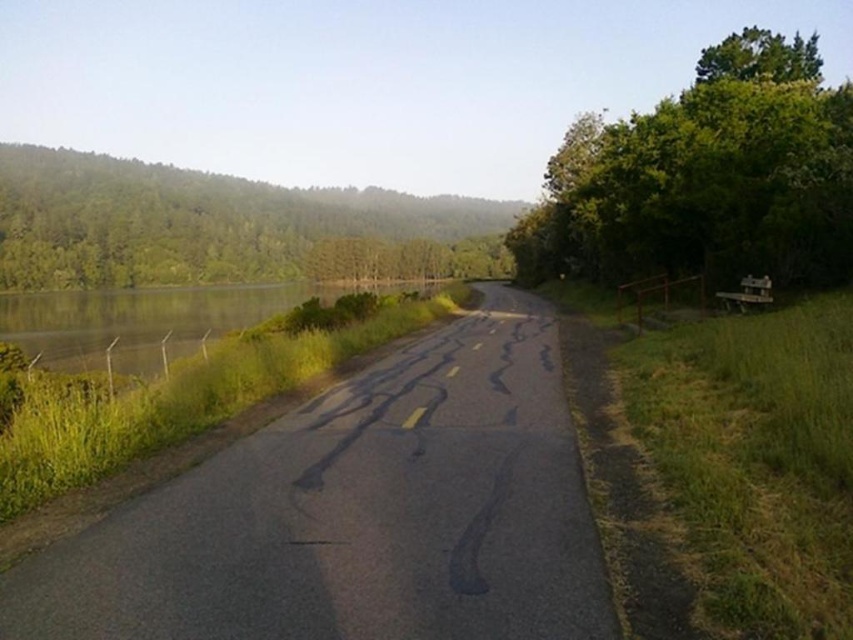
Looking at this image, does asphalt road at left have a lesser height compared to green leafy tree at right?

Indeed, asphalt road at left has a lesser height compared to green leafy tree at right.

You are a GUI agent. You are given a task and a screenshot of the screen. Output one action in this format:
    pyautogui.click(x=<x>, y=<y>)
    Task: Click on the asphalt road at left
    The height and width of the screenshot is (640, 853).
    Given the screenshot: What is the action you would take?
    pyautogui.click(x=358, y=513)

Can you confirm if green leafy tree at right is positioned to the right of green grassy water at left?

Yes, green leafy tree at right is to the right of green grassy water at left.

Which of these two, green leafy tree at right or green grassy water at left, stands taller?

green leafy tree at right is taller.

You are a GUI agent. You are given a task and a screenshot of the screen. Output one action in this format:
    pyautogui.click(x=<x>, y=<y>)
    Task: Click on the green leafy tree at right
    The image size is (853, 640).
    Given the screenshot: What is the action you would take?
    pyautogui.click(x=705, y=177)

The image size is (853, 640). Identify the location of green leafy tree at right. (705, 177).

Describe the element at coordinates (207, 225) in the screenshot. I see `green leafy trees at upper left` at that location.

Is point (57, 275) farther from camera compared to point (80, 353)?

Yes, point (57, 275) is behind point (80, 353).

Between point (125, 177) and point (401, 285), which one is positioned behind?

The point (125, 177) is behind.

In order to click on green leafy trees at upper left in this screenshot , I will do `click(207, 225)`.